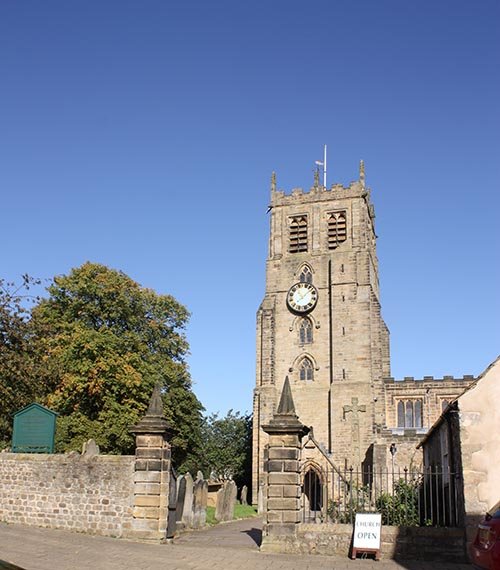
Where is `white circular clock`? The image size is (500, 570). white circular clock is located at coordinates (305, 300).